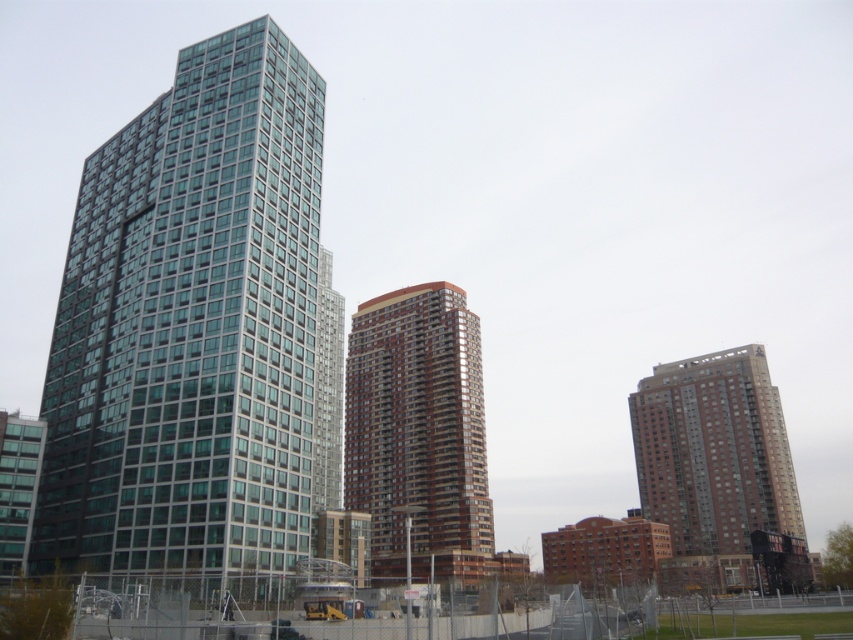
Question: Does glassy teal skyscraper at left have a smaller size compared to brown glassy building at center?

Choices:
 (A) no
 (B) yes

Answer: (B)

Question: Which point appears closest to the camera in this image?

Choices:
 (A) (769, 502)
 (B) (155, 525)
 (C) (479, 550)

Answer: (B)

Question: Among these objects, which one is farthest from the camera?

Choices:
 (A) brown glassy building at center
 (B) brown glassy building at right
 (C) glassy teal skyscraper at left

Answer: (B)

Question: Is glassy teal skyscraper at left wider than brown glassy building at center?

Choices:
 (A) yes
 (B) no

Answer: (A)

Question: Which point is closer to the camera?

Choices:
 (A) brown glassy building at right
 (B) glassy teal skyscraper at left
 (C) brown glassy building at center

Answer: (B)

Question: Observing the image, what is the correct spatial positioning of glassy teal skyscraper at left in reference to brown glassy building at center?

Choices:
 (A) left
 (B) right

Answer: (A)